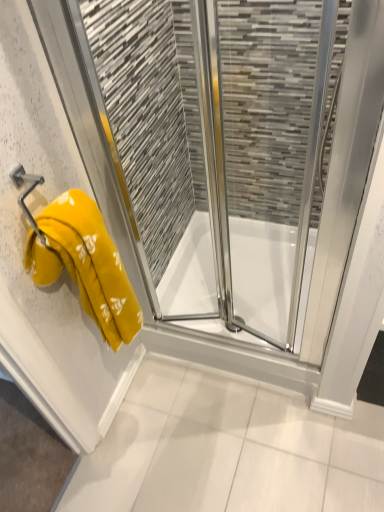
Question: Does point (24, 179) appear closer or farther from the camera than point (62, 212)?

Choices:
 (A) farther
 (B) closer

Answer: (B)

Question: Would you say metallic yellow towel bar at left is inside or outside yellow fabric towel at left?

Choices:
 (A) inside
 (B) outside

Answer: (B)

Question: Which of these objects is positioned farthest from the yellow towel at left?

Choices:
 (A) metallic yellow towel bar at left
 (B) transparent glass shower at center
 (C) yellow fabric towel at left

Answer: (A)

Question: Which object is the closest to the transparent glass shower at center?

Choices:
 (A) yellow towel at left
 (B) yellow fabric towel at left
 (C) metallic yellow towel bar at left

Answer: (A)